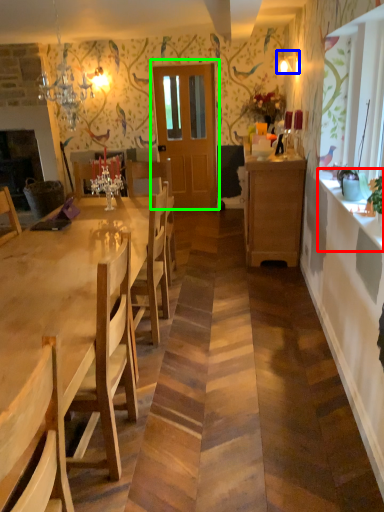
Question: Which object is the farthest from counter top (highlighted by a red box)? Choose among these: lamp (highlighted by a blue box) or door (highlighted by a green box).

Choices:
 (A) lamp
 (B) door

Answer: (B)